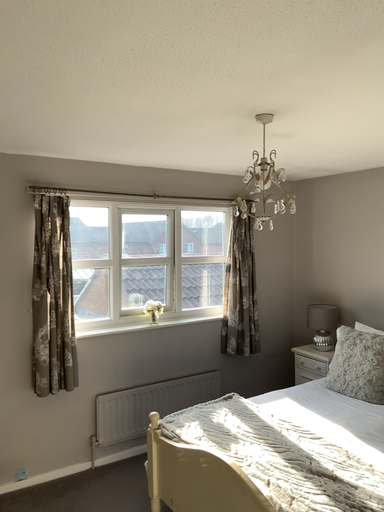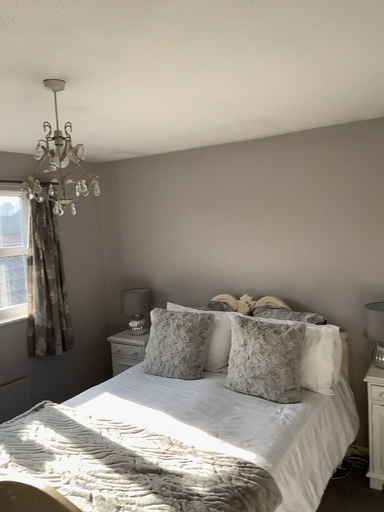
Question: How did the camera likely rotate when shooting the video?

Choices:
 (A) rotated left
 (B) rotated right

Answer: (B)